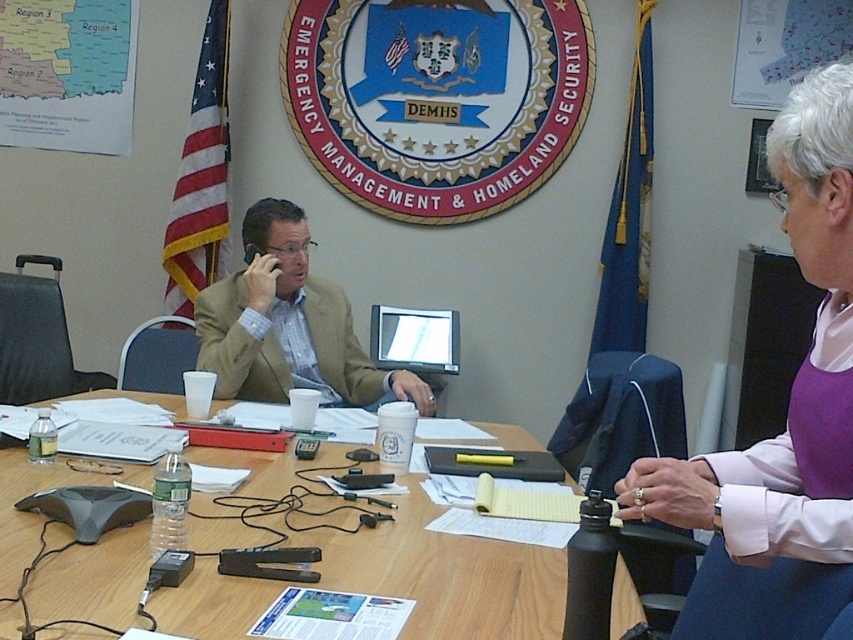
Between point (35, 576) and point (248, 305), which one is positioned behind?

Positioned behind is point (248, 305).

What do you see at coordinates (442, 573) in the screenshot?
I see `wooden table at center` at bounding box center [442, 573].

Who is more distant from viewer, (x=10, y=545) or (x=283, y=298)?

Positioned behind is point (x=283, y=298).

Find the location of a particular element. Image resolution: width=853 pixels, height=640 pixels. wooden table at center is located at coordinates (442, 573).

Does wooden table at center have a greater height compared to purple fabric shirt at upper right?

No.

Is point (0, 618) positioned behind point (779, 592)?

Yes, point (0, 618) is farther from viewer.

Find the location of `wooden table at center`. wooden table at center is located at coordinates (442, 573).

Does purple fabric shirt at upper right have a greater height compared to light brown leather jacket at center?

Correct, purple fabric shirt at upper right is much taller as light brown leather jacket at center.

Who is positioned more to the left, purple fabric shirt at upper right or light brown leather jacket at center?

From the viewer's perspective, light brown leather jacket at center appears more on the left side.

You are a GUI agent. You are given a task and a screenshot of the screen. Output one action in this format:
    pyautogui.click(x=<x>, y=<y>)
    Task: Click on the purple fabric shirt at upper right
    
    Given the screenshot: What is the action you would take?
    (786, 419)